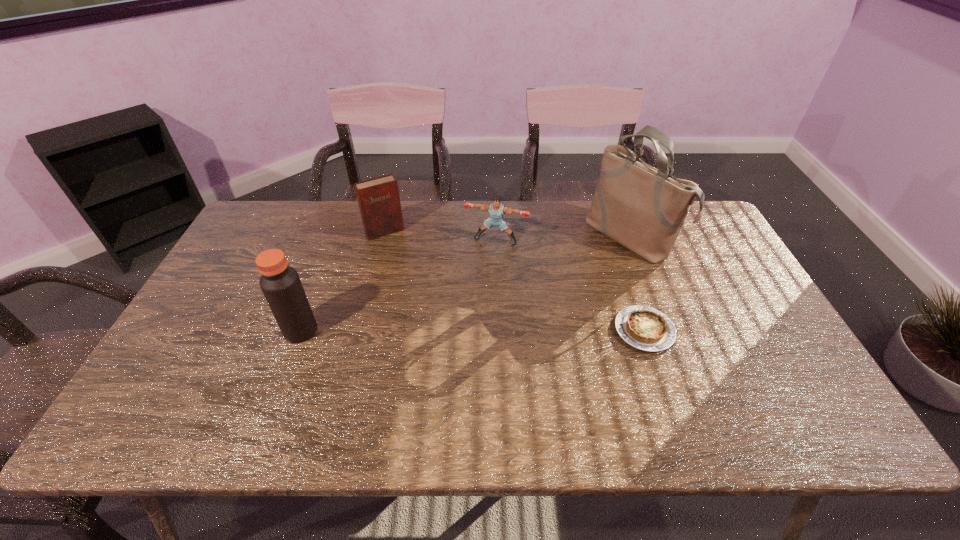
Where is `vacant space located on the front-facing side of the third object from right to left`? vacant space located on the front-facing side of the third object from right to left is located at coordinates (472, 289).

You are a GUI agent. You are given a task and a screenshot of the screen. Output one action in this format:
    pyautogui.click(x=<x>, y=<y>)
    Task: Click on the vacant space situated 0.330m on the front-facing side of the third object from right to left
    
    Given the screenshot: What is the action you would take?
    pyautogui.click(x=459, y=326)

I want to click on free spot located 0.200m on the front-facing side of the third object from right to left, so click(x=472, y=292).

You are a GUI agent. You are given a task and a screenshot of the screen. Output one action in this format:
    pyautogui.click(x=<x>, y=<y>)
    Task: Click on the vacant point located 0.360m on the front cover of the fourth object from right to left
    
    Given the screenshot: What is the action you would take?
    pyautogui.click(x=437, y=315)

This screenshot has height=540, width=960. Identify the location of vacant space situated 0.080m on the front cover of the fourth object from right to left. (400, 254).

Where is `vacant space situated 0.160m on the front cover of the fourth object from right to left`? This screenshot has width=960, height=540. vacant space situated 0.160m on the front cover of the fourth object from right to left is located at coordinates (410, 270).

What are the coordinates of `vacant region located 0.060m on the front-facing side of the shoulder bag` in the screenshot? It's located at (592, 266).

Where is `free point located on the front-facing side of the shoulder bag`? The image size is (960, 540). free point located on the front-facing side of the shoulder bag is located at coordinates (580, 275).

Locate an element on the screen. This screenshot has width=960, height=540. vacant space located on the front-facing side of the shoulder bag is located at coordinates (535, 307).

Where is `puncher that is at the far edge`? puncher that is at the far edge is located at coordinates (496, 210).